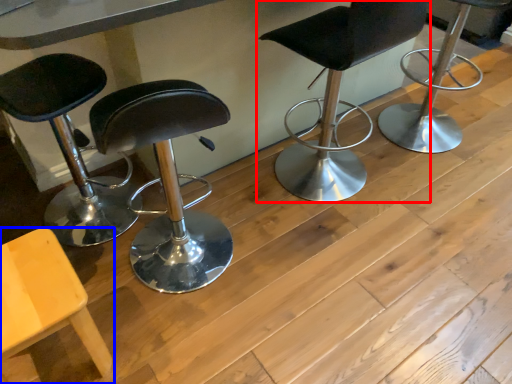
Question: Which object appears closest to the camera in this image, chair (highlighted by a red box) or chair (highlighted by a blue box)?

Choices:
 (A) chair
 (B) chair

Answer: (B)